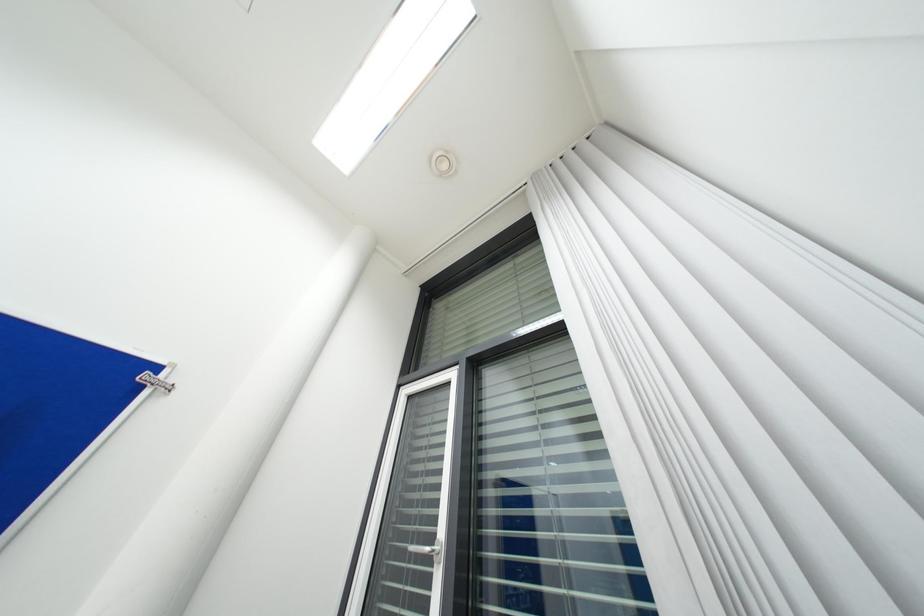
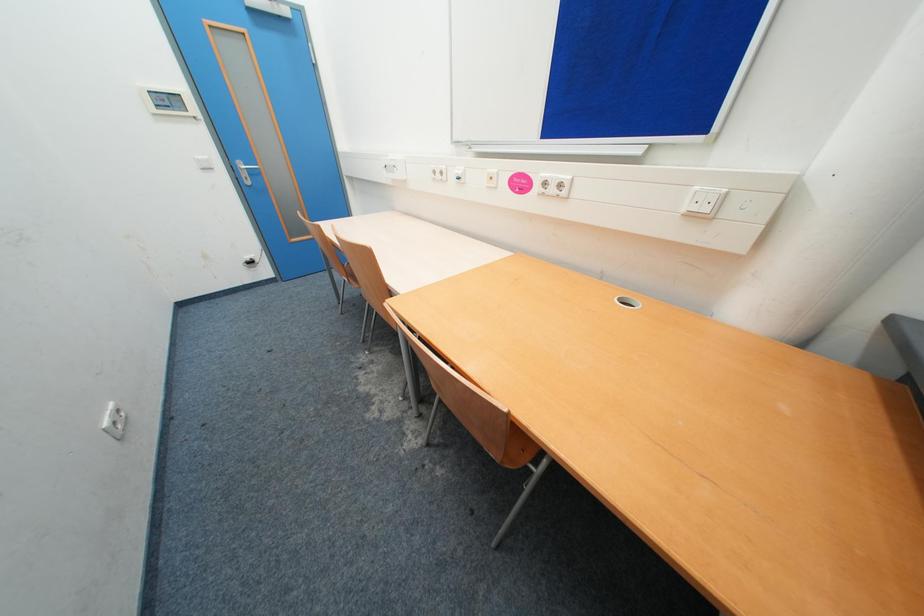
Based on the continuous images, in which direction is the camera rotating?

The rotation direction of the camera is left-down.